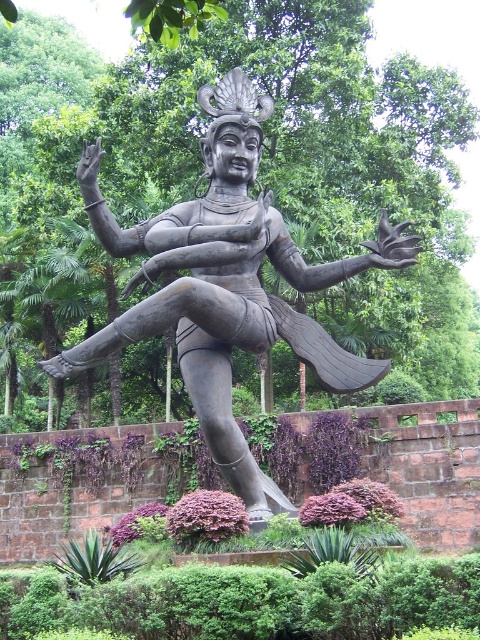
You are standing in a garden and see the bronze statue at center. If you want to take a closer look, how many steps do you need to take to reach it if each step covers approximately 0.75 meters?

The bronze statue at center is 37.25 meters away from camera. Since each step covers 0.75 meters, you would need to take approximately 49.67 steps to reach it. Since you can only take whole steps, you would need to take 50 steps.

You are a gardener planning to water the green leafy plants at center and the bronze statue at center. Since both are at the center, how can you distinguish their positions to locate them?

The bronze statue at center is to the right of green leafy plants at center, so you can locate the plants on the left and the statue on the right within the central area.

Based on the photo, you are standing in a garden with a bronze statue at center. You want to take a photo of the bronze statue at center from a position that is exactly 2 meters away from it. Given that the statue is located at point coordinates (x=227, y=284), can you determine if this point is suitable for taking the photo?

The bronze statue at center is located at point coordinates (x=227, y=284). To determine if this point is suitable for taking the photo from exactly 2 meters away, you would need to know the scale of the coordinate system. Since the coordinate values are between 0 and 1, the actual distance corresponding to these coordinates isn without the necessary information about the scale or units of the coordinate system, it is impossible to confirm if the point is exactly 2 meters away from the statue.